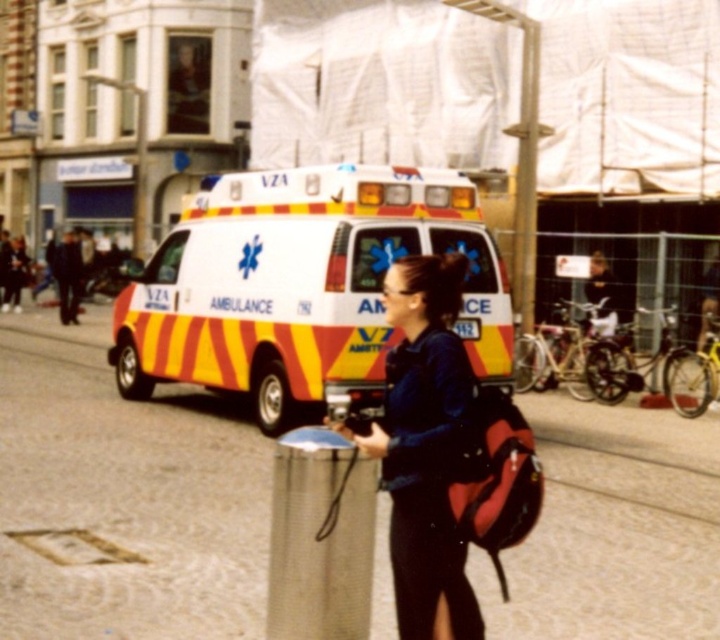
You are a delivery person who needs to place a box on the ground near the ambulance. The box must be placed on the concrete pavement at center and the matte blue shirt at center. However, the box can only be placed on surfaces that are at least as tall as the shirt. Can you place the box on either of these surfaces?

The concrete pavement at center is not as tall as the matte blue shirt at center. Since the box requires a surface at least as tall as the shirt, the concrete pavement is too short. The matte blue shirt at center is the only surface that meets the height requirement, so the box can be placed there.

You are standing at the point with coordinates point (125, 493). What is the material of the surface you are standing on?

The point (125, 493) indicates concrete pavement at center, so the surface is made of concrete.